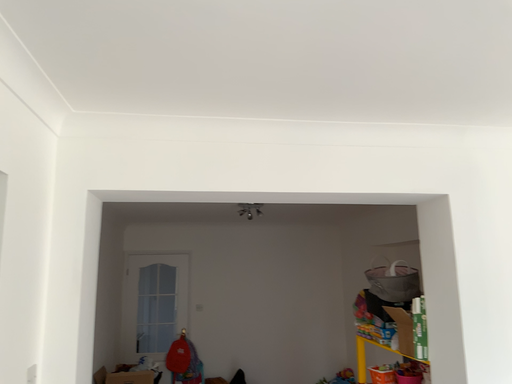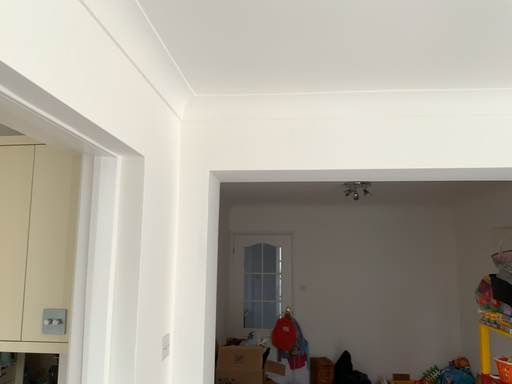
Question: Which way did the camera rotate in the video?

Choices:
 (A) rotated left
 (B) rotated right

Answer: (A)